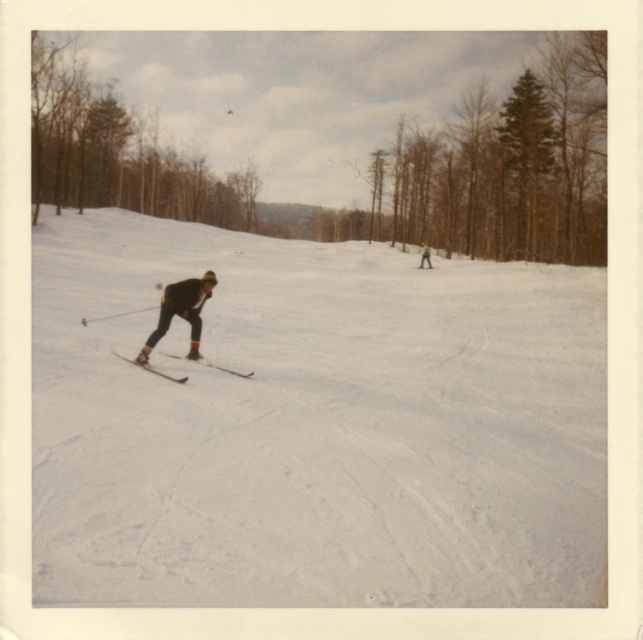
Question: Which point is farther to the camera?

Choices:
 (A) brown wood tree at upper left
 (B) metallic silver skis at center
 (C) matte black ski at center
 (D) light brown wooden stick at center

Answer: (D)

Question: Which of the following is the farthest from the observer?

Choices:
 (A) (145, 147)
 (B) (201, 422)

Answer: (A)

Question: From the image, what is the correct spatial relationship of matte black ski at center in relation to light brown wooden stick at center?

Choices:
 (A) above
 (B) below

Answer: (B)

Question: Which of the following is the closest to the observer?

Choices:
 (A) dark brown leather skis at center
 (B) brown textured tree at upper right
 (C) matte black ski at center

Answer: (C)

Question: Can you confirm if brown textured tree at upper right is positioned below metallic silver skis at center?

Choices:
 (A) yes
 (B) no

Answer: (B)

Question: Is dark brown leather skis at center closer to the viewer compared to metallic silver skis at center?

Choices:
 (A) yes
 (B) no

Answer: (B)